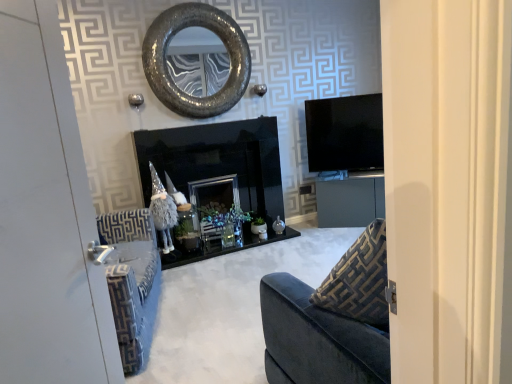
Question: Can you confirm if textured metallic mirror at upper center is shorter than black glossy fireplace at center?

Choices:
 (A) yes
 (B) no

Answer: (A)

Question: From a real-world perspective, is textured metallic mirror at upper center under black glossy fireplace at center?

Choices:
 (A) no
 (B) yes

Answer: (A)

Question: Considering the relative sizes of textured metallic mirror at upper center and black glossy fireplace at center in the image provided, is textured metallic mirror at upper center thinner than black glossy fireplace at center?

Choices:
 (A) yes
 (B) no

Answer: (A)

Question: Does textured metallic mirror at upper center lie behind black glossy fireplace at center?

Choices:
 (A) yes
 (B) no

Answer: (A)

Question: Is textured metallic mirror at upper center oriented towards black glossy fireplace at center?

Choices:
 (A) no
 (B) yes

Answer: (A)

Question: Based on their sizes in the image, would you say matte gray cabinet at center is bigger or smaller than black glossy fireplace at center?

Choices:
 (A) small
 (B) big

Answer: (A)

Question: Is matte gray cabinet at center in front of or behind black glossy fireplace at center in the image?

Choices:
 (A) behind
 (B) front

Answer: (A)

Question: From a real-world perspective, relative to black glossy fireplace at center, is matte gray cabinet at center vertically above or below?

Choices:
 (A) below
 (B) above

Answer: (A)

Question: Is matte gray cabinet at center situated inside black glossy fireplace at center or outside?

Choices:
 (A) inside
 (B) outside

Answer: (B)

Question: Is black glossy fireplace at center taller or shorter than matte gray cabinet at center?

Choices:
 (A) tall
 (B) short

Answer: (A)

Question: Considering the positions of black glossy fireplace at center and matte gray cabinet at center in the image, is black glossy fireplace at center bigger or smaller than matte gray cabinet at center?

Choices:
 (A) big
 (B) small

Answer: (A)

Question: Would you say black glossy fireplace at center is inside or outside matte gray cabinet at center?

Choices:
 (A) outside
 (B) inside

Answer: (A)

Question: From the image's perspective, relative to matte gray cabinet at center, is black glossy fireplace at center above or below?

Choices:
 (A) above
 (B) below

Answer: (A)

Question: Considering their positions, is textured metallic mirror at upper center located in front of or behind matte gray cabinet at center?

Choices:
 (A) front
 (B) behind

Answer: (A)

Question: From a real-world perspective, relative to matte gray cabinet at center, is textured metallic mirror at upper center vertically above or below?

Choices:
 (A) below
 (B) above

Answer: (B)